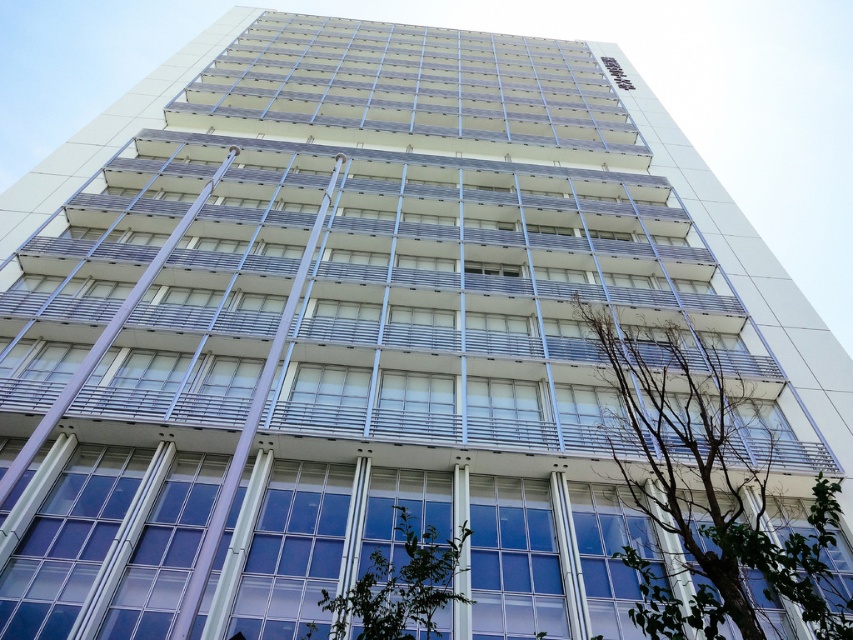
Question: Does green leafy tree at right have a smaller size compared to green leafy tree at center?

Choices:
 (A) no
 (B) yes

Answer: (A)

Question: From the image, what is the correct spatial relationship of green leafy tree at right in relation to green leafy tree at center?

Choices:
 (A) above
 (B) below

Answer: (A)

Question: Does green leafy tree at right have a lesser width compared to green leafy tree at center?

Choices:
 (A) no
 (B) yes

Answer: (A)

Question: Which of the following is the closest to the observer?

Choices:
 (A) (467, 600)
 (B) (753, 461)

Answer: (A)

Question: Which point appears closest to the camera in this image?

Choices:
 (A) (730, 496)
 (B) (436, 563)

Answer: (B)